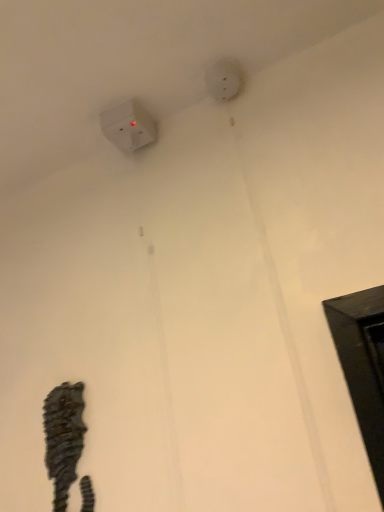
What do you see at coordinates (63, 438) in the screenshot? This screenshot has width=384, height=512. I see `rustic wood seahorse at lower left` at bounding box center [63, 438].

What are the coordinates of `rustic wood seahorse at lower left` in the screenshot? It's located at (63, 438).

Which is less distant, (218, 79) or (49, 423)?

Clearly, point (218, 79) is more distant from the camera than point (49, 423).

How different are the orientations of white matte electric outlet at upper center and rustic wood seahorse at lower left in degrees?

white matte electric outlet at upper center and rustic wood seahorse at lower left are facing 0.953 degrees away from each other.

Who is taller, white matte electric outlet at upper center or rustic wood seahorse at lower left?

rustic wood seahorse at lower left is taller.

Is white matte electric outlet at upper center smaller than rustic wood seahorse at lower left?

Correct, white matte electric outlet at upper center occupies less space than rustic wood seahorse at lower left.

Does point (207, 73) lie in front of point (105, 119)?

Yes, point (207, 73) is closer to viewer.

Consider the image. Is white plastic power plug at upper left inside white matte electric outlet at upper center?

No.

In order to click on power plugs and sockets behind the white matte electric outlet at upper center in this screenshot , I will do `click(128, 126)`.

Is white matte electric outlet at upper center positioned with its back to white plastic power plug at upper left?

No, white matte electric outlet at upper center is not facing away from white plastic power plug at upper left.

In the scene shown: Can white plastic power plug at upper left be found inside rustic wood seahorse at lower left?

That's incorrect, white plastic power plug at upper left is not inside rustic wood seahorse at lower left.

Which object is more forward, rustic wood seahorse at lower left or white plastic power plug at upper left?

rustic wood seahorse at lower left is in front.

Can you confirm if rustic wood seahorse at lower left is bigger than white plastic power plug at upper left?

Yes, rustic wood seahorse at lower left is bigger than white plastic power plug at upper left.

Is rustic wood seahorse at lower left next to white plastic power plug at upper left and touching it?

No, rustic wood seahorse at lower left is not touching white plastic power plug at upper left.

Is white plastic power plug at upper left aimed at white matte electric outlet at upper center?

No, white plastic power plug at upper left is not turned towards white matte electric outlet at upper center.

Between white plastic power plug at upper left and white matte electric outlet at upper center, which one has less height?

With less height is white matte electric outlet at upper center.

Considering the sizes of objects white plastic power plug at upper left and white matte electric outlet at upper center in the image provided, who is thinner, white plastic power plug at upper left or white matte electric outlet at upper center?

Thinner between the two is white matte electric outlet at upper center.

Can you confirm if white plastic power plug at upper left is wider than rustic wood seahorse at lower left?

→ Correct, the width of white plastic power plug at upper left exceeds that of rustic wood seahorse at lower left.

What's the angular difference between white plastic power plug at upper left and rustic wood seahorse at lower left's facing directions?

white plastic power plug at upper left and rustic wood seahorse at lower left are facing 0.953 degrees away from each other.

Which point is more forward, (126,129) or (48,400)?

The point (48,400) is in front.

Is white plastic power plug at upper left inside or outside of rustic wood seahorse at lower left?

The correct answer is: outside.

Is rustic wood seahorse at lower left bigger than white matte electric outlet at upper center?

Indeed, rustic wood seahorse at lower left has a larger size compared to white matte electric outlet at upper center.

From the image's perspective, is rustic wood seahorse at lower left over white matte electric outlet at upper center?

Incorrect, from the image's perspective, rustic wood seahorse at lower left is lower than white matte electric outlet at upper center.

Which is more distant, (72, 439) or (230, 88)?

Positioned behind is point (230, 88).

From the picture: Considering the sizes of rustic wood seahorse at lower left and white matte electric outlet at upper center in the image, is rustic wood seahorse at lower left taller or shorter than white matte electric outlet at upper center?

In the image, rustic wood seahorse at lower left appears to be taller than white matte electric outlet at upper center.

Find the location of a particular element. This screenshot has height=512, width=384. electric outlet behind the rustic wood seahorse at lower left is located at coordinates (223, 80).

Identify the location of electric outlet that is above the white plastic power plug at upper left (from the image's perspective). The width and height of the screenshot is (384, 512). (223, 80).

In the scene shown: Estimate the real-world distances between objects in this image. Which object is closer to white plastic power plug at upper left, white matte electric outlet at upper center or rustic wood seahorse at lower left?

Among the two, white matte electric outlet at upper center is located nearer to white plastic power plug at upper left.

When comparing their distances from white plastic power plug at upper left, does rustic wood seahorse at lower left or white matte electric outlet at upper center seem further?

rustic wood seahorse at lower left is positioned further to the anchor white plastic power plug at upper left.

When comparing their distances from white matte electric outlet at upper center, does white plastic power plug at upper left or rustic wood seahorse at lower left seem closer?

white plastic power plug at upper left is positioned closer to the anchor white matte electric outlet at upper center.

Which object lies further to the anchor point white matte electric outlet at upper center, rustic wood seahorse at lower left or white plastic power plug at upper left?

Among the two, rustic wood seahorse at lower left is located further to white matte electric outlet at upper center.

Based on the photo, estimate the real-world distances between objects in this image. Which object is closer to rustic wood seahorse at lower left, white plastic power plug at upper left or white matte electric outlet at upper center?

white plastic power plug at upper left is positioned closer to the anchor rustic wood seahorse at lower left.

Considering their positions, is white matte electric outlet at upper center positioned closer to rustic wood seahorse at lower left than white plastic power plug at upper left?

The object closer to rustic wood seahorse at lower left is white plastic power plug at upper left.

You are a GUI agent. You are given a task and a screenshot of the screen. Output one action in this format:
    pyautogui.click(x=<x>, y=<y>)
    Task: Click on the power plugs and sockets between white matte electric outlet at upper center and rustic wood seahorse at lower left vertically
    The image size is (384, 512).
    Given the screenshot: What is the action you would take?
    pyautogui.click(x=128, y=126)